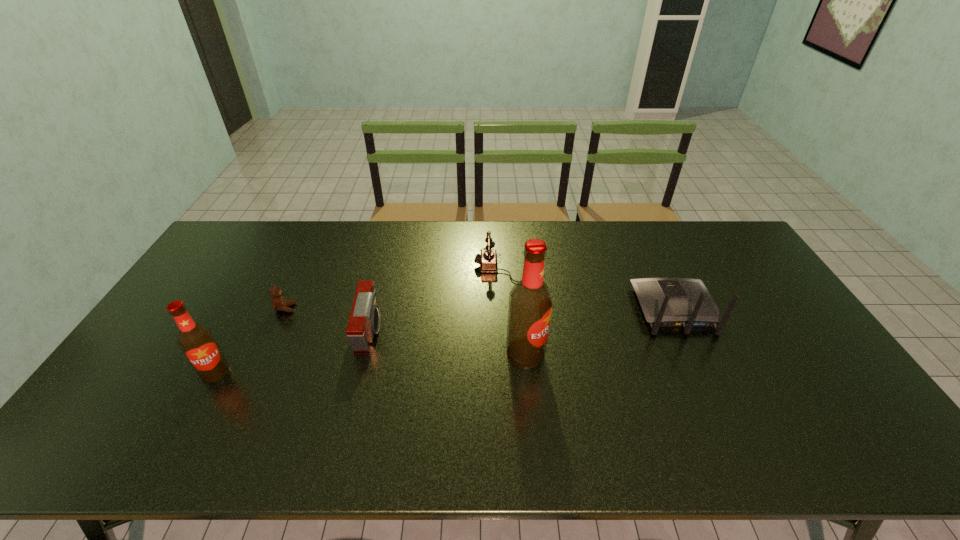
The image size is (960, 540). Find the location of `object that is positioned at the far edge`. object that is positioned at the far edge is located at coordinates (488, 259).

Find the location of a particular element. The image size is (960, 540). blank space at the far edge of the desktop is located at coordinates (356, 241).

In the image, there is a desktop. Where is `free space at the near edge`? This screenshot has height=540, width=960. free space at the near edge is located at coordinates (612, 417).

The height and width of the screenshot is (540, 960). I want to click on free location at the right edge, so click(x=725, y=275).

This screenshot has height=540, width=960. In order to click on free point at the near right corner in this screenshot , I will do `click(847, 406)`.

Locate an element on the screen. Image resolution: width=960 pixels, height=540 pixels. free spot between the telephone and the router is located at coordinates (590, 289).

Locate an element on the screen. The height and width of the screenshot is (540, 960). vacant space in between the taller beer bottle and the leftmost object is located at coordinates (371, 363).

At what (x,y) coordinates should I click in order to perform the action: click on vacant space in between the fifth object from right to left and the shorter beer bottle. Please return your answer as a coordinate pair (x, y). Looking at the image, I should click on (251, 340).

In order to click on free space that is in between the taller beer bottle and the router in this screenshot , I will do `click(600, 332)`.

Identify the location of vacant area that lies between the fifth shortest object and the teddy bear. The width and height of the screenshot is (960, 540). (251, 340).